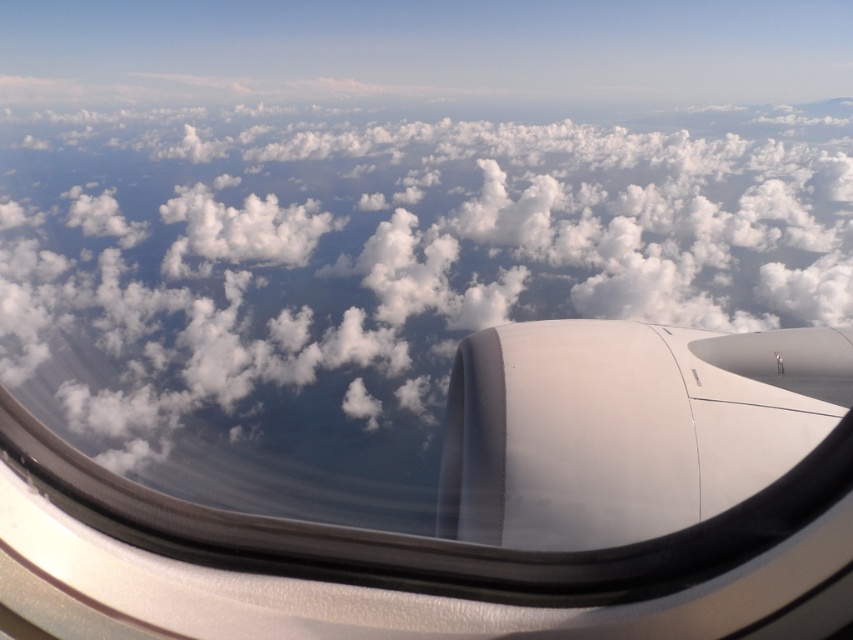
You are a passenger sitting by the window on an airplane. You notice the white fluffy cloud at center and the white matte engine at lower right. Which object appears bigger in the window view?

The white fluffy cloud at center appears bigger in the window view because it has a larger size compared to the white matte engine at lower right.